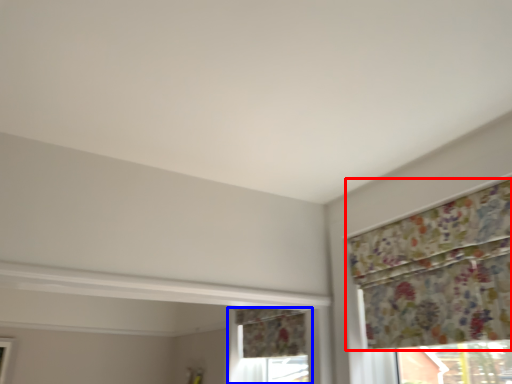
Question: Which object is further to the camera taking this photo, curtain (highlighted by a red box) or window (highlighted by a blue box)?

Choices:
 (A) curtain
 (B) window

Answer: (B)